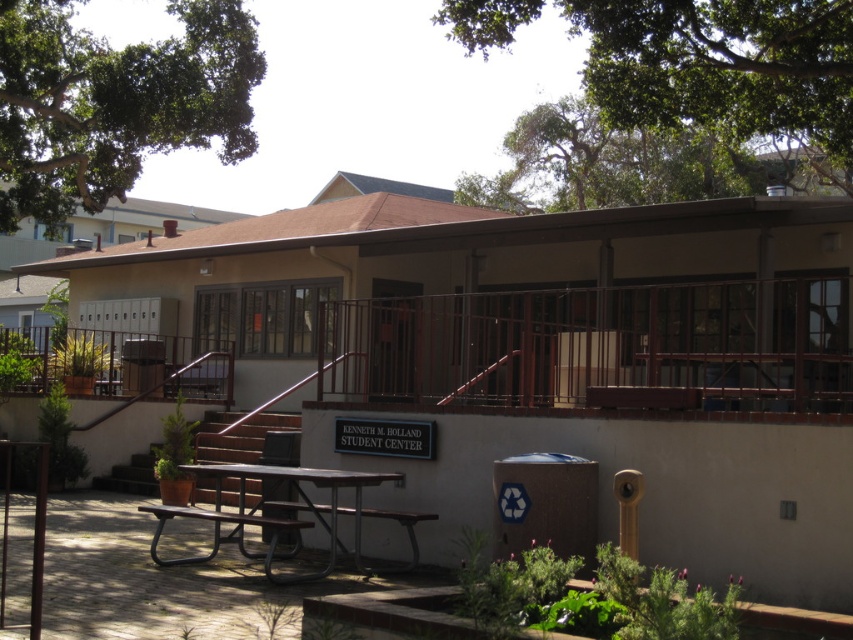
Question: Among these objects, which one is nearest to the camera?

Choices:
 (A) metallic picnic table at lower center
 (B) brown metal picnic table at center
 (C) brown metal bench at center

Answer: (A)

Question: Which point is closer to the camera taking this photo?

Choices:
 (A) (434, 516)
 (B) (270, 470)

Answer: (A)

Question: Does brown metal picnic table at center have a lesser width compared to brown metal bench at center?

Choices:
 (A) no
 (B) yes

Answer: (A)

Question: Is metallic picnic table at lower center further to the viewer compared to brown metal bench at center?

Choices:
 (A) no
 (B) yes

Answer: (A)

Question: Is brown metal picnic table at center positioned before metallic picnic table at lower center?

Choices:
 (A) no
 (B) yes

Answer: (A)

Question: Considering the real-world distances, which object is closest to the brown metal bench at center?

Choices:
 (A) brown metal picnic table at center
 (B) metallic picnic table at lower center

Answer: (A)